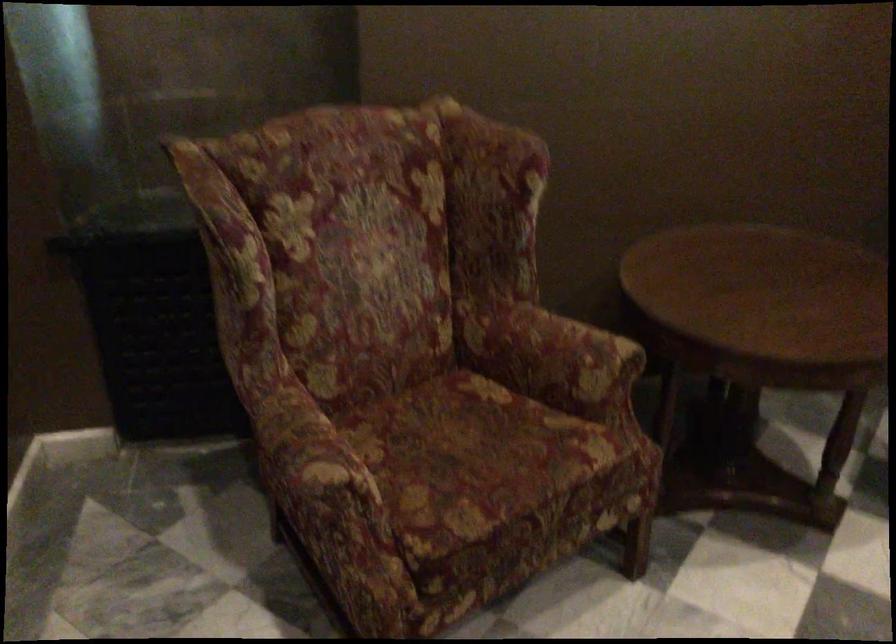
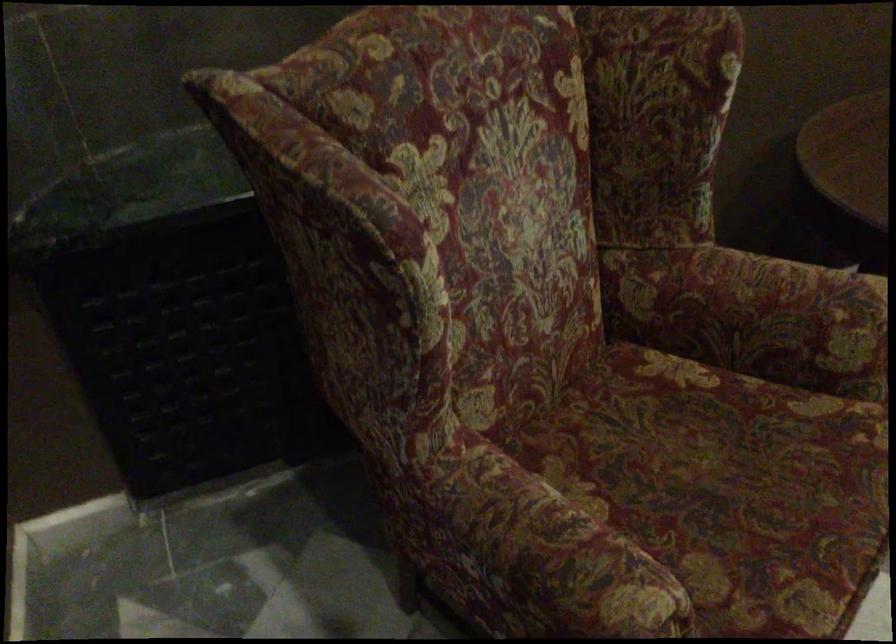
Find the pixel in the second image that matches (560,359) in the first image.

(786, 321)